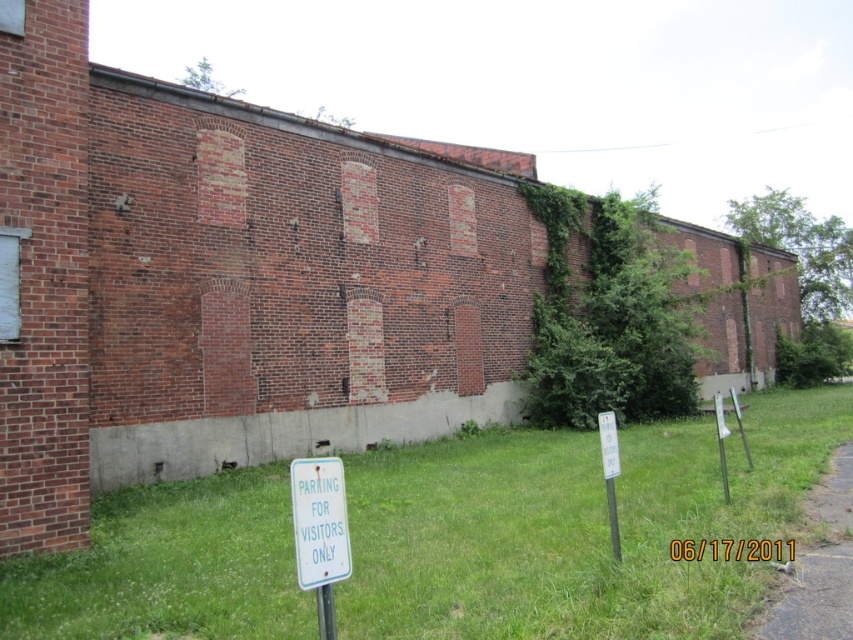
Question: Does green grass at lower center come in front of gravel at lower right?

Choices:
 (A) yes
 (B) no

Answer: (A)

Question: Does green grass at lower center appear under white plastic sign at lower center?

Choices:
 (A) no
 (B) yes

Answer: (B)

Question: Can you confirm if green grass at lower center is smaller than gravel at lower right?

Choices:
 (A) no
 (B) yes

Answer: (A)

Question: Which object is the closest to the green grass at lower center?

Choices:
 (A) white plastic sign at lower center
 (B) gravel at lower right

Answer: (B)

Question: Estimate the real-world distances between objects in this image. Which object is farther from the gravel at lower right?

Choices:
 (A) green grass at lower center
 (B) white plastic sign at lower center

Answer: (B)

Question: Which of the following is the closest to the observer?

Choices:
 (A) gravel at lower right
 (B) white plastic sign at lower center

Answer: (B)